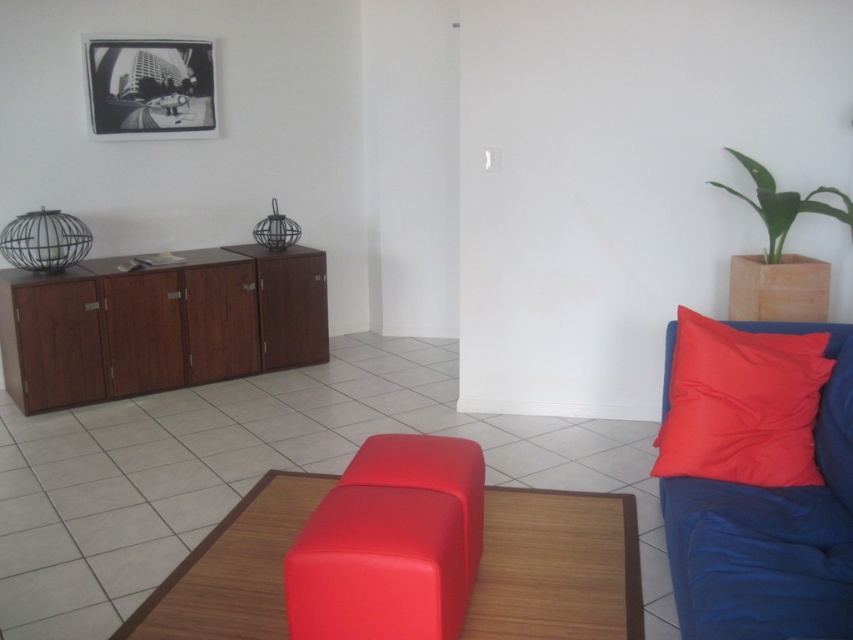
Which is above, matte red ottoman at center or matte red stool at center?

Positioned higher is matte red stool at center.

Does matte red ottoman at center appear on the right side of matte red stool at center?

Indeed, matte red ottoman at center is positioned on the right side of matte red stool at center.

Image resolution: width=853 pixels, height=640 pixels. Find the location of `matte red ottoman at center`. matte red ottoman at center is located at coordinates (556, 566).

Is matte red ottoman at center bigger than wooden cabinet at left?

No, matte red ottoman at center is not bigger than wooden cabinet at left.

In the scene shown: Who is lower down, matte red ottoman at center or wooden cabinet at left?

Positioned lower is matte red ottoman at center.

Describe the element at coordinates (556, 566) in the screenshot. Image resolution: width=853 pixels, height=640 pixels. I see `matte red ottoman at center` at that location.

This screenshot has width=853, height=640. In order to click on matte red ottoman at center in this screenshot , I will do `click(556, 566)`.

Between matte red ottoman at center and black glossy picture frame at upper left, which one has more height?

black glossy picture frame at upper left

Based on the photo, who is positioned more to the right, matte red ottoman at center or black glossy picture frame at upper left?

Positioned to the right is matte red ottoman at center.

Where is `matte red ottoman at center`? Image resolution: width=853 pixels, height=640 pixels. matte red ottoman at center is located at coordinates (556, 566).

Locate an element on the screen. The width and height of the screenshot is (853, 640). matte red ottoman at center is located at coordinates (556, 566).